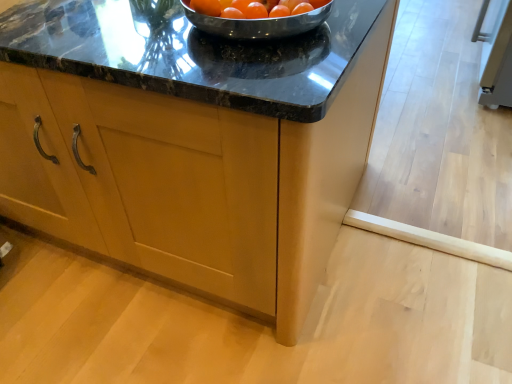
What do you see at coordinates (269, 4) in the screenshot? I see `orange matte tomato at center` at bounding box center [269, 4].

Locate an element on the screen. orange matte tomato at center is located at coordinates (269, 4).

Where is `matte wood cabinet at center`? The height and width of the screenshot is (384, 512). matte wood cabinet at center is located at coordinates (191, 142).

The height and width of the screenshot is (384, 512). What do you see at coordinates (191, 142) in the screenshot?
I see `matte wood cabinet at center` at bounding box center [191, 142].

Identify the location of orange matte tomato at center. (269, 4).

Does matte wood cabinet at center appear on the right side of orange matte tomato at center?

No.

In the scene shown: Does matte wood cabinet at center lie behind orange matte tomato at center?

No, the depth of matte wood cabinet at center is less than that of orange matte tomato at center.

Which is further, (x=183, y=122) or (x=270, y=2)?

The point (x=183, y=122) is farther.

Consider the image. From the image's perspective, is matte wood cabinet at center located above or below orange matte tomato at center?

Based on their image positions, matte wood cabinet at center is located beneath orange matte tomato at center.

From a real-world perspective, is matte wood cabinet at center physically located above or below orange matte tomato at center?

In terms of real-world spatial position, matte wood cabinet at center is below orange matte tomato at center.

Considering the relative sizes of matte wood cabinet at center and orange matte tomato at center in the image provided, is matte wood cabinet at center thinner than orange matte tomato at center?

Incorrect, the width of matte wood cabinet at center is not less than that of orange matte tomato at center.

Between matte wood cabinet at center and orange matte tomato at center, which one has less height?

Standing shorter between the two is orange matte tomato at center.

Does matte wood cabinet at center have a larger size compared to orange matte tomato at center?

Yes, matte wood cabinet at center is bigger than orange matte tomato at center.

Is orange matte tomato at center completely or partially inside matte wood cabinet at center?

No, orange matte tomato at center is not inside matte wood cabinet at center.

Is matte wood cabinet at center next to orange matte tomato at center?

No, matte wood cabinet at center is not in contact with orange matte tomato at center.

Is matte wood cabinet at center facing towards orange matte tomato at center?

No, matte wood cabinet at center is not facing towards orange matte tomato at center.

What's the angular difference between matte wood cabinet at center and orange matte tomato at center's facing directions?

There is a 3.78-degree angle between the facing directions of matte wood cabinet at center and orange matte tomato at center.

How far apart are matte wood cabinet at center and orange matte tomato at center?

A distance of 18.47 inches exists between matte wood cabinet at center and orange matte tomato at center.

Identify the location of tomato behind the matte wood cabinet at center. The height and width of the screenshot is (384, 512). (269, 4).

Between orange matte tomato at center and matte wood cabinet at center, which one appears on the left side from the viewer's perspective?

Positioned to the left is matte wood cabinet at center.

Is orange matte tomato at center behind matte wood cabinet at center?

That is True.

Does point (273, 2) come closer to viewer compared to point (154, 28)?

Yes, point (273, 2) is in front of point (154, 28).

From the image's perspective, is orange matte tomato at center over matte wood cabinet at center?

Indeed, from the image's perspective, orange matte tomato at center is shown above matte wood cabinet at center.

From a real-world perspective, is orange matte tomato at center above or below matte wood cabinet at center?

orange matte tomato at center is above matte wood cabinet at center.

Is orange matte tomato at center thinner than matte wood cabinet at center?

Correct, the width of orange matte tomato at center is less than that of matte wood cabinet at center.

Between orange matte tomato at center and matte wood cabinet at center, which one has less height?

orange matte tomato at center.

Which of these two, orange matte tomato at center or matte wood cabinet at center, is smaller?

orange matte tomato at center.

Is matte wood cabinet at center a part of orange matte tomato at center?

No, matte wood cabinet at center is located outside of orange matte tomato at center.

Does orange matte tomato at center touch matte wood cabinet at center?

No, orange matte tomato at center is not with matte wood cabinet at center.

Is orange matte tomato at center positioned with its back to matte wood cabinet at center?

That's not correct — orange matte tomato at center is not looking away from matte wood cabinet at center.

How different are the orientations of orange matte tomato at center and matte wood cabinet at center in degrees?

3.78 degrees.

I want to click on cabinetry in front of the orange matte tomato at center, so pyautogui.click(x=191, y=142).

I want to click on cabinetry beneath the orange matte tomato at center (from a real-world perspective), so click(x=191, y=142).

This screenshot has height=384, width=512. What are the coordinates of `tomato on the right of matte wood cabinet at center` in the screenshot? It's located at (269, 4).